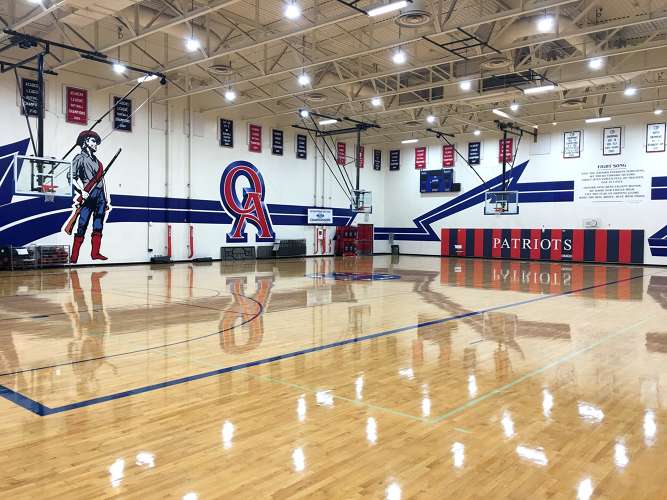
Image resolution: width=667 pixels, height=500 pixels. I want to click on ceiling, so click(370, 31).